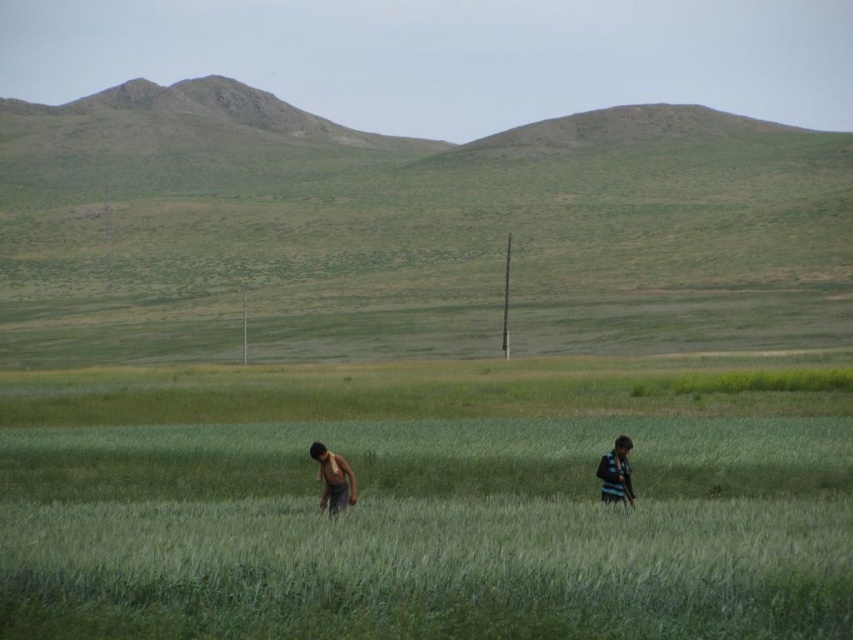
You are a photographer trying to capture both the dark green shirt at center and the dark brown shirt at center in a single shot. Given their positions, which shirt should you focus on first to ensure both are in frame?

The dark green shirt at center is located below the dark brown shirt at center, so you should focus on the dark brown shirt at center first to ensure both are in frame.

You are standing at the origin point in the image. There is a dark brown shirt at center represented by point (334, 477). What direction should you walk to reach the dark brown shirt at center?

The dark brown shirt at center is located at coordinates point (334, 477), so you should walk towards the center of the image to reach it.

You are a photographer trying to capture a photo of the two people in the rural landscape. You want to ensure both the dark green shirt at center and the striped fabric shirt at right are clearly visible in the frame. Based on their positions, which shirt should you focus on first to ensure both are in focus?

The dark green shirt at center is to the left of the striped fabric shirt at right. Since they are both in the same plane of the foreground, focusing on the dark green shirt at center would ensure the striped fabric shirt at right remains in focus as well due to their proximity.